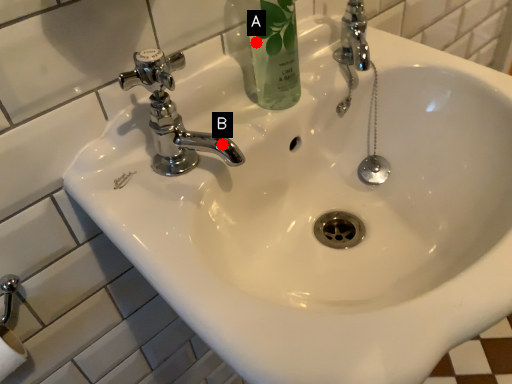
Question: Two points are circled on the image, labeled by A and B beside each circle. Which of the following is the closest to the observer?

Choices:
 (A) A is closer
 (B) B is closer

Answer: (B)